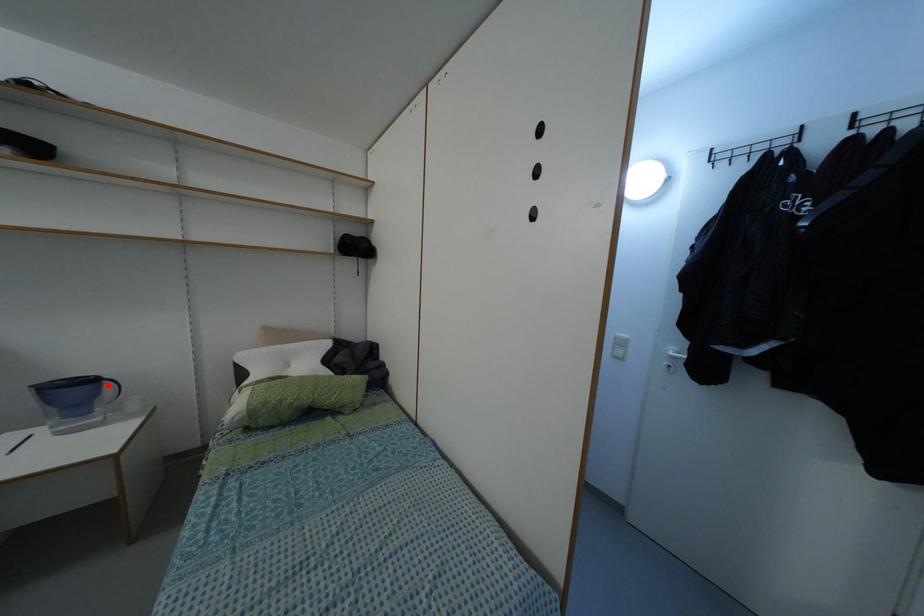
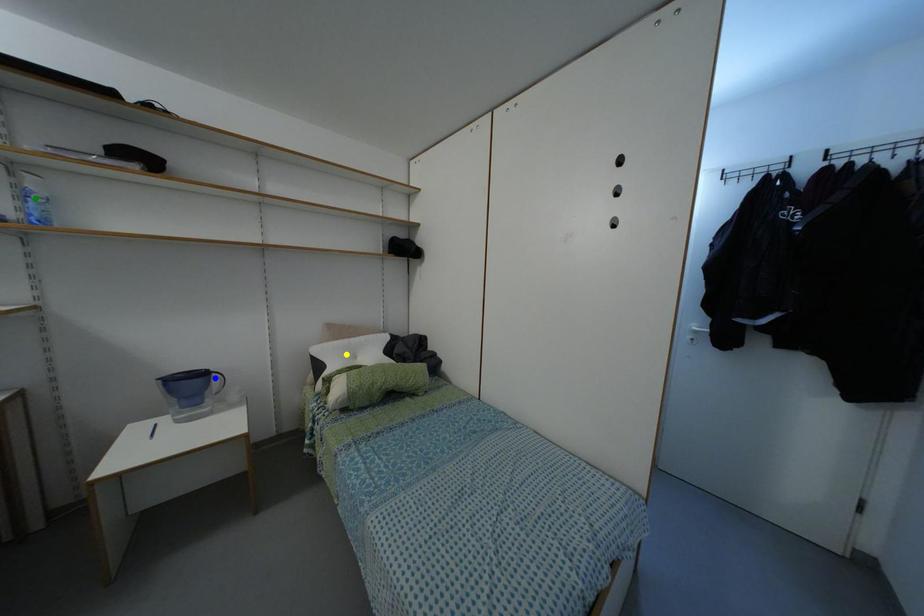
Question: I am providing you with two images of the same scene from different viewpoints. A red point is marked on the first image. You are given multiple points on the second image. Which mark in image 2 goes with the point in image 1?

Choices:
 (A) yellow point
 (B) blue point
 (C) green point

Answer: (B)